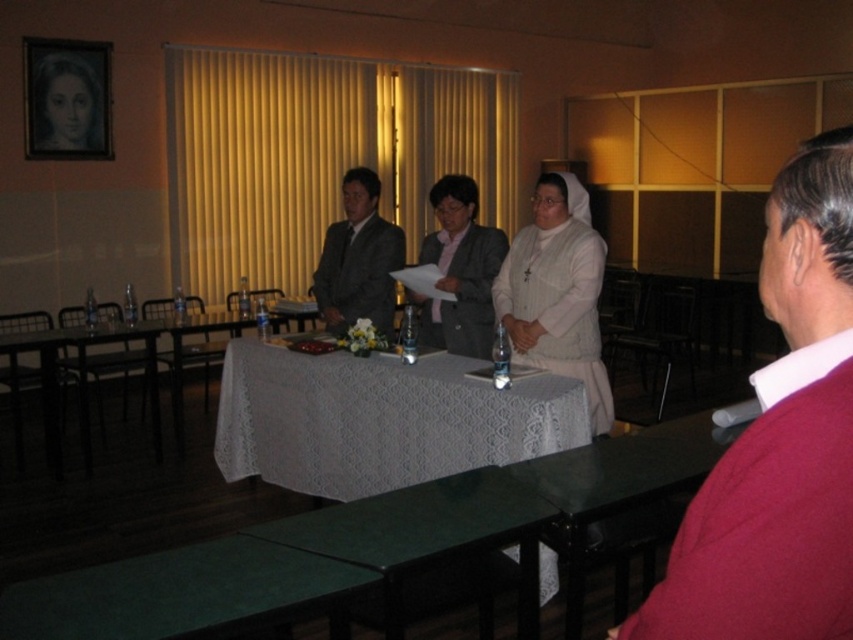
Does green matte table at lower center have a lesser height compared to matte gray suit at center?

Indeed, green matte table at lower center has a lesser height compared to matte gray suit at center.

Which of these two, green matte table at lower center or matte gray suit at center, stands shorter?

Standing shorter between the two is green matte table at lower center.

Who is more distant from viewer, (300, 605) or (358, 192)?

Point (358, 192)

Find the location of a particular element. The height and width of the screenshot is (640, 853). green matte table at lower center is located at coordinates (180, 593).

Between green matte table at lower center and green matte table at center, which one appears on the right side from the viewer's perspective?

Positioned to the right is green matte table at center.

Does green matte table at lower center have a smaller size compared to green matte table at center?

Indeed, green matte table at lower center has a smaller size compared to green matte table at center.

You are a GUI agent. You are given a task and a screenshot of the screen. Output one action in this format:
    pyautogui.click(x=<x>, y=<y>)
    Task: Click on the green matte table at lower center
    Image resolution: width=853 pixels, height=640 pixels.
    Given the screenshot: What is the action you would take?
    pyautogui.click(x=180, y=593)

Consider the image. Is matte gray suit at center shorter than wooden portrait at upper left?

In fact, matte gray suit at center may be taller than wooden portrait at upper left.

Can you confirm if matte gray suit at center is positioned to the right of wooden portrait at upper left?

Indeed, matte gray suit at center is positioned on the right side of wooden portrait at upper left.

The height and width of the screenshot is (640, 853). Find the location of `matte gray suit at center`. matte gray suit at center is located at coordinates (358, 259).